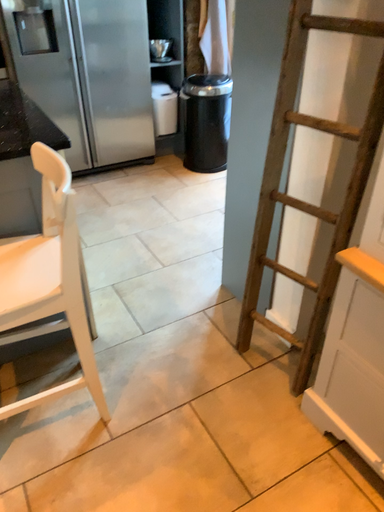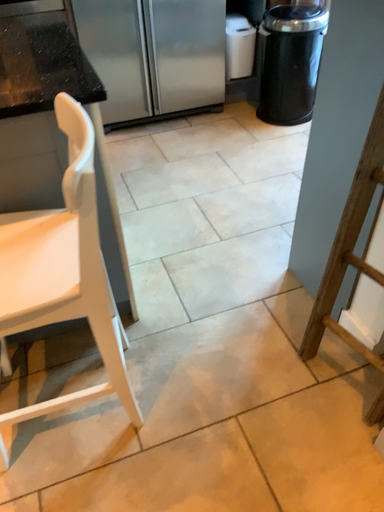
Question: Which way did the camera rotate in the video?

Choices:
 (A) rotated downward
 (B) rotated upward

Answer: (A)